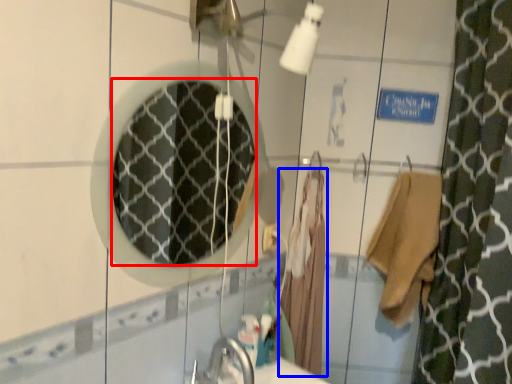
Question: Which object appears closest to the camera in this image, mirror (highlighted by a red box) or bathrobe (highlighted by a blue box)?

Choices:
 (A) mirror
 (B) bathrobe

Answer: (A)